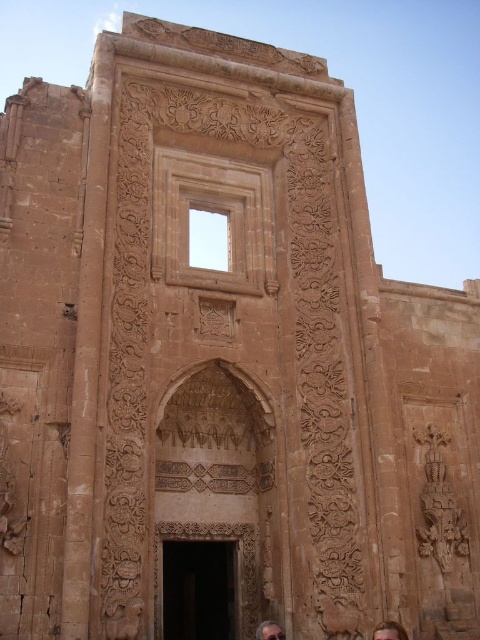
Question: Which point is closer to the camera?

Choices:
 (A) (397, 625)
 (B) (256, 634)

Answer: (A)

Question: Which object appears closest to the camera in this image?

Choices:
 (A) gray hair at lower center
 (B) brown hair at lower center

Answer: (B)

Question: Is brown hair at lower center bigger than gray hair at lower center?

Choices:
 (A) yes
 (B) no

Answer: (B)

Question: Does brown hair at lower center appear over gray hair at lower center?

Choices:
 (A) yes
 (B) no

Answer: (A)

Question: Among these objects, which one is farthest from the camera?

Choices:
 (A) brown hair at lower center
 (B) gray hair at lower center

Answer: (B)

Question: Is brown hair at lower center positioned before gray hair at lower center?

Choices:
 (A) yes
 (B) no

Answer: (A)